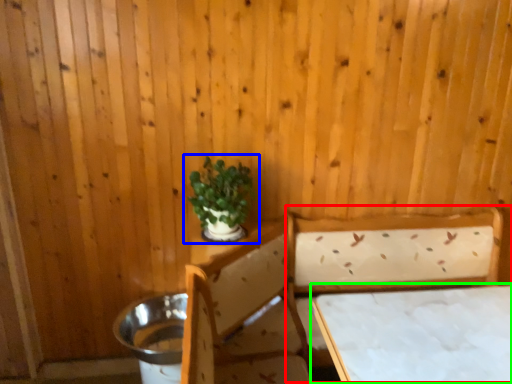
Question: Considering the real-world distances, which object is closest to bed (highlighted by a red box)? houseplant (highlighted by a blue box) or table (highlighted by a green box).

Choices:
 (A) houseplant
 (B) table

Answer: (B)